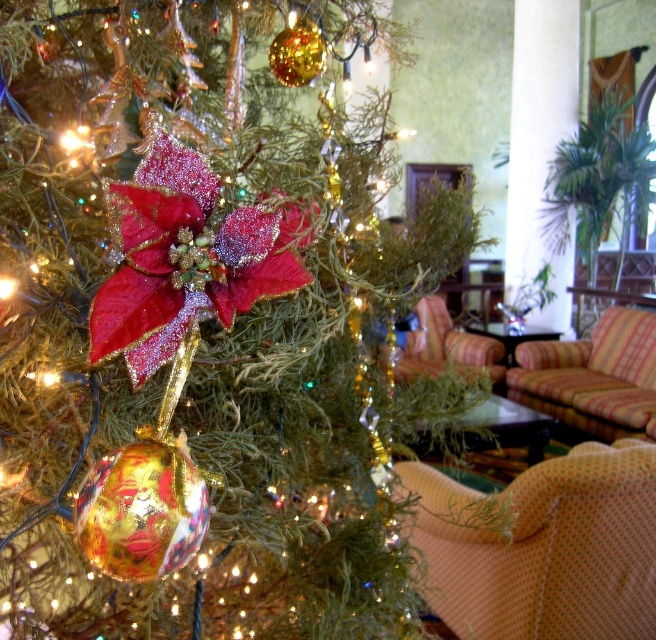
Based on the coordinates provided, can you identify which object corresponds to the point at (186, 259) in the scene?

The point at (186, 259) corresponds to the shiny velvet poinsettia at center.

You are standing in front of the Christmas tree and want to reach both the point at coordinates point (574, 509) and point (609, 314). Which point would you need to extend your arm further to touch?

Point (609, 314) requires extending your arm further because it is farther from the camera compared to point (574, 509).